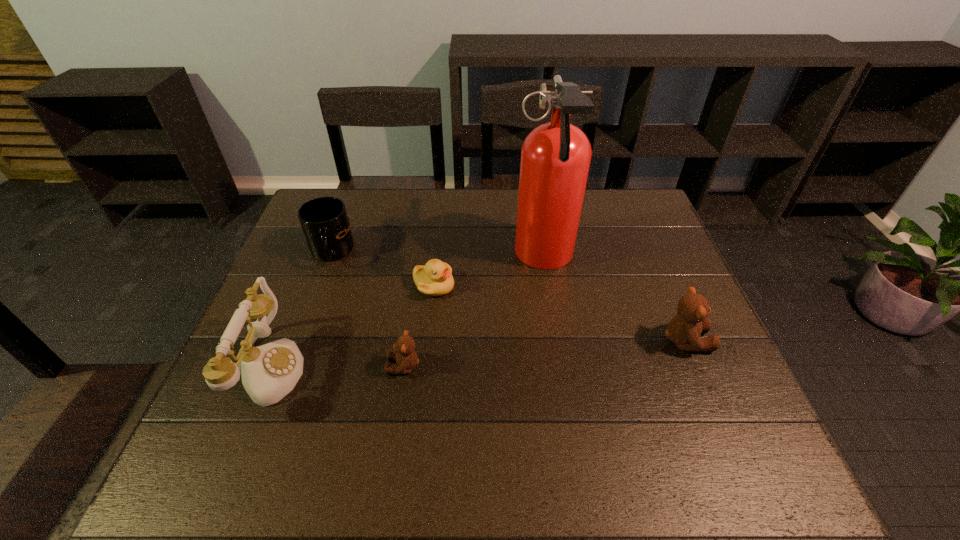
To achieve even spacing by inserting another teddy_bear among them, please point to a vacant spot for this new teddy_bear. Please provide its 2D coordinates. Your answer should be formatted as a tuple, i.e. [(x, y)], where the tuple contains the x and y coordinates of a point satisfying the conditions above.

[(548, 353)]